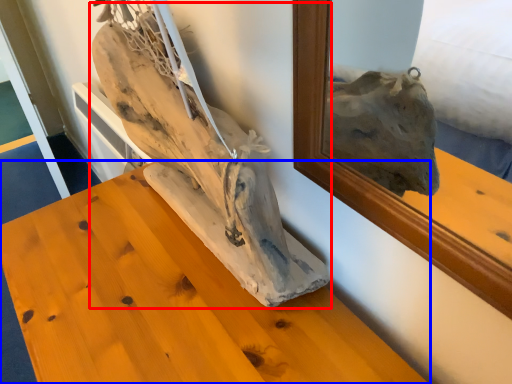
Question: Which object appears closest to the camera in this image, sculpture (highlighted by a red box) or furniture (highlighted by a blue box)?

Choices:
 (A) sculpture
 (B) furniture

Answer: (A)